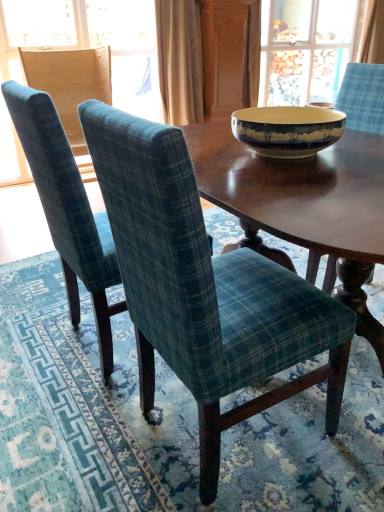
In order to face teal plaid chair at left, the 3th chair when ordered from right to left, should I rotate leftwards or rightwards?

Rotate left and turn 15.585 degrees.

Where is `blue plaid curtain at upper right, which ranks as the second curtain in left-to-right order`? The width and height of the screenshot is (384, 512). blue plaid curtain at upper right, which ranks as the second curtain in left-to-right order is located at coordinates (372, 34).

The width and height of the screenshot is (384, 512). What are the coordinates of `clear glass door at upper center` in the screenshot? It's located at (304, 49).

Where is `green plaid fabric chair at center, which appears as the first chair when viewed from the right`? The width and height of the screenshot is (384, 512). green plaid fabric chair at center, which appears as the first chair when viewed from the right is located at coordinates (205, 288).

Describe the element at coordinates (230, 55) in the screenshot. I see `wooden screen door at upper center` at that location.

Image resolution: width=384 pixels, height=512 pixels. I want to click on teal plaid chair at left, arranged as the first chair when viewed from the left, so click(x=70, y=83).

Which is correct: teal plaid chair at center, the 2th chair viewed from the left, is inside blue plaid curtain at upper right, marked as the first curtain in a back-to-front arrangement, or outside of it?

teal plaid chair at center, the 2th chair viewed from the left, is not enclosed by blue plaid curtain at upper right, marked as the first curtain in a back-to-front arrangement.

Is teal plaid chair at center, which is the 2th chair in right-to-left order, aimed at blue plaid curtain at upper right, which is counted as the 2th curtain, starting from the front?

No, teal plaid chair at center, which is the 2th chair in right-to-left order, is not facing towards blue plaid curtain at upper right, which is counted as the 2th curtain, starting from the front.

Which object is wider, teal plaid chair at center, which is the 2th chair in right-to-left order, or blue plaid curtain at upper right, marked as the first curtain in a top-to-bottom arrangement?

Wider between the two is teal plaid chair at center, which is the 2th chair in right-to-left order.

Locate an element on the screen. chair that is the 2nd one when counting forward from the blue plaid curtain at upper right, which ranks as the second curtain in left-to-right order is located at coordinates (67, 210).

Who is bigger, blue plaid curtain at upper right, which is counted as the 2th curtain, starting from the front, or blue fabric chair at left?

blue fabric chair at left.

Identify the location of the 2nd curtain above the blue fabric chair at left (from the image's perspective). (372, 34).

Does blue plaid curtain at upper right, which ranks as the second curtain in left-to-right order, turn towards blue fabric chair at left?

No, blue plaid curtain at upper right, which ranks as the second curtain in left-to-right order, does not turn towards blue fabric chair at left.

Considering the relative sizes of blue plaid curtain at upper right, which ranks as the second curtain in left-to-right order, and blue fabric chair at left in the image provided, is blue plaid curtain at upper right, which ranks as the second curtain in left-to-right order, thinner than blue fabric chair at left?

No.

Is clear glass door at upper center positioned far away from matte ceramic bowl at center?

clear glass door at upper center is far away from matte ceramic bowl at center.

You are a GUI agent. You are given a task and a screenshot of the screen. Output one action in this format:
    pyautogui.click(x=<x>, y=<y>)
    Task: Click on the glass door on the right of the matte ceramic bowl at center
    The height and width of the screenshot is (512, 384).
    Given the screenshot: What is the action you would take?
    pyautogui.click(x=304, y=49)

Who is more distant, clear glass door at upper center or matte ceramic bowl at center?

clear glass door at upper center is behind.

Based on the photo, between clear glass door at upper center and matte ceramic bowl at center, which one appears on the right side from the viewer's perspective?

Positioned to the right is clear glass door at upper center.

Looking at the image, does teal plaid chair at center, the 2th chair viewed from the left, seem bigger or smaller compared to clear glass door at upper center?

Clearly, teal plaid chair at center, the 2th chair viewed from the left, is smaller in size than clear glass door at upper center.

In the image, is teal plaid chair at center, the 2th chair viewed from the left, positioned in front of or behind clear glass door at upper center?

Visually, teal plaid chair at center, the 2th chair viewed from the left, is located in front of clear glass door at upper center.

Looking at this image, can you see teal plaid chair at center, the 2th chair viewed from the left, touching clear glass door at upper center?

No, teal plaid chair at center, the 2th chair viewed from the left, is not in contact with clear glass door at upper center.

Image resolution: width=384 pixels, height=512 pixels. What are the coordinates of `the 2nd chair to the left when counting from the clear glass door at upper center` in the screenshot? It's located at (67, 210).

Is teal plaid chair at center, which is the 2th chair in right-to-left order, in front of or behind beige fabric curtain at upper center, marked as the 1th curtain in a bottom-to-top arrangement, in the image?

teal plaid chair at center, which is the 2th chair in right-to-left order, is in front of beige fabric curtain at upper center, marked as the 1th curtain in a bottom-to-top arrangement.

In the scene shown: Measure the distance between teal plaid chair at center, the 2th chair viewed from the left, and beige fabric curtain at upper center, arranged as the second curtain when viewed from the right.

2.42 meters.

Based on their sizes in the image, would you say teal plaid chair at center, the 2th chair viewed from the left, is bigger or smaller than beige fabric curtain at upper center, marked as the 1th curtain in a bottom-to-top arrangement?

Clearly, teal plaid chair at center, the 2th chair viewed from the left, is larger in size than beige fabric curtain at upper center, marked as the 1th curtain in a bottom-to-top arrangement.

In terms of width, does teal plaid chair at center, the 2th chair viewed from the left, look wider or thinner when compared to beige fabric curtain at upper center, which is the second curtain in top-to-bottom order?

Clearly, teal plaid chair at center, the 2th chair viewed from the left, has more width compared to beige fabric curtain at upper center, which is the second curtain in top-to-bottom order.

Is beige fabric curtain at upper center, acting as the 1th curtain starting from the front, shorter than teal plaid chair at center, the 2th chair viewed from the left?

In fact, beige fabric curtain at upper center, acting as the 1th curtain starting from the front, may be taller than teal plaid chair at center, the 2th chair viewed from the left.

From the picture: Considering the sizes of objects beige fabric curtain at upper center, arranged as the second curtain when viewed from the right, and teal plaid chair at center, which is the 2th chair in right-to-left order, in the image provided, who is thinner, beige fabric curtain at upper center, arranged as the second curtain when viewed from the right, or teal plaid chair at center, which is the 2th chair in right-to-left order,?

beige fabric curtain at upper center, arranged as the second curtain when viewed from the right.

From a real-world perspective, starting from the teal plaid chair at center, the 2th chair viewed from the left, which curtain is the 1st one vertically above it? Please provide its 2D coordinates.

[(179, 61)]

Can you confirm if teal plaid chair at center, which is the 2th chair in right-to-left order, is smaller than green plaid fabric chair at center, the third chair when ordered from left to right?

Indeed, teal plaid chair at center, which is the 2th chair in right-to-left order, has a smaller size compared to green plaid fabric chair at center, the third chair when ordered from left to right.

From a real-world perspective, relative to green plaid fabric chair at center, the third chair when ordered from left to right, is teal plaid chair at center, the 2th chair viewed from the left, vertically above or below?

From a real-world perspective, teal plaid chair at center, the 2th chair viewed from the left, is physically above green plaid fabric chair at center, the third chair when ordered from left to right.

Which chair is the 1st one when counting from the left side of the green plaid fabric chair at center, the third chair when ordered from left to right? Please provide its 2D coordinates.

[(67, 210)]

Considering the sizes of objects teal plaid chair at center, which is the 2th chair in right-to-left order, and green plaid fabric chair at center, the third chair when ordered from left to right, in the image provided, who is wider, teal plaid chair at center, which is the 2th chair in right-to-left order, or green plaid fabric chair at center, the third chair when ordered from left to right,?

Wider between the two is green plaid fabric chair at center, the third chair when ordered from left to right.

The height and width of the screenshot is (512, 384). What are the coordinates of `chair that is the 2nd one when counting forward from the blue plaid curtain at upper right, which ranks as the second curtain in left-to-right order` in the screenshot? It's located at (67, 210).

What are the coordinates of `window located underneath the blue plaid curtain at upper right, which is counted as the 2th curtain, starting from the front (from a real-world perspective)` in the screenshot? It's located at (93, 42).

Considering their positions, is teal plaid chair at center, which is the 2th chair in right-to-left order, positioned further to clear glass door at upper center than wooden screen door at upper center?

teal plaid chair at center, which is the 2th chair in right-to-left order.

Which object lies nearer to the anchor point blue plaid curtain at upper right, the second curtain ordered from the bottom, teal plaid chair at left, arranged as the first chair when viewed from the left, or green plaid fabric chair at center, which appears as the first chair when viewed from the right?

Based on the image, teal plaid chair at left, arranged as the first chair when viewed from the left, appears to be nearer to blue plaid curtain at upper right, the second curtain ordered from the bottom.

Considering their positions, is matte ceramic bowl at center positioned further to blue fabric chair at left than blue plaid curtain at upper right, acting as the 1th curtain starting from the right?

matte ceramic bowl at center is further to blue fabric chair at left.

Estimate the real-world distances between objects in this image. Which object is closer to blue fabric chair at left, wooden screen door at upper center or blue plaid curtain at upper right, acting as the 1th curtain starting from the right?

wooden screen door at upper center.

Based on their spatial positions, is teal plaid chair at center, which is the 2th chair in right-to-left order, or clear glass door at upper center further from blue plaid curtain at upper right, which is counted as the 2th curtain, starting from the front?

Among the two, teal plaid chair at center, which is the 2th chair in right-to-left order, is located further to blue plaid curtain at upper right, which is counted as the 2th curtain, starting from the front.

Estimate the real-world distances between objects in this image. Which object is further from wooden screen door at upper center, beige fabric curtain at upper center, marked as the 1th curtain in a bottom-to-top arrangement, or matte ceramic bowl at center?

Based on the image, matte ceramic bowl at center appears to be further to wooden screen door at upper center.

From the image, which object appears to be farther from clear glass door at upper center, wooden screen door at upper center or matte ceramic bowl at center?

matte ceramic bowl at center lies further to clear glass door at upper center than the other object.

When comparing their distances from matte ceramic bowl at center, does teal plaid chair at left, arranged as the first chair when viewed from the left, or clear glass door at upper center seem further?

Among the two, clear glass door at upper center is located further to matte ceramic bowl at center.

Identify the location of bowl between green plaid fabric chair at center, which appears as the first chair when viewed from the right, and beige fabric curtain at upper center, arranged as the second curtain when viewed from the right, along the z-axis. The height and width of the screenshot is (512, 384). (287, 130).

Locate an element on the screen. The width and height of the screenshot is (384, 512). chair positioned between teal plaid chair at center, the 2th chair viewed from the left, and clear glass door at upper center from near to far is located at coordinates (70, 83).

This screenshot has width=384, height=512. Find the location of `chair between matte ceramic bowl at center and wooden screen door at upper center from front to back`. chair between matte ceramic bowl at center and wooden screen door at upper center from front to back is located at coordinates (x=70, y=83).

The image size is (384, 512). In order to click on chair between teal plaid chair at center, which is the 2th chair in right-to-left order, and wooden screen door at upper center from front to back in this screenshot , I will do `click(70, 83)`.